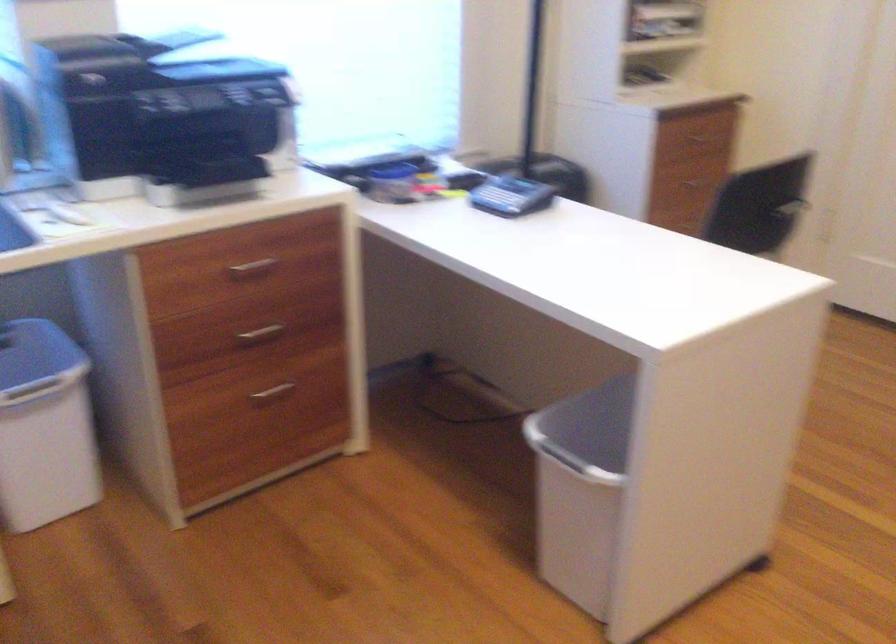
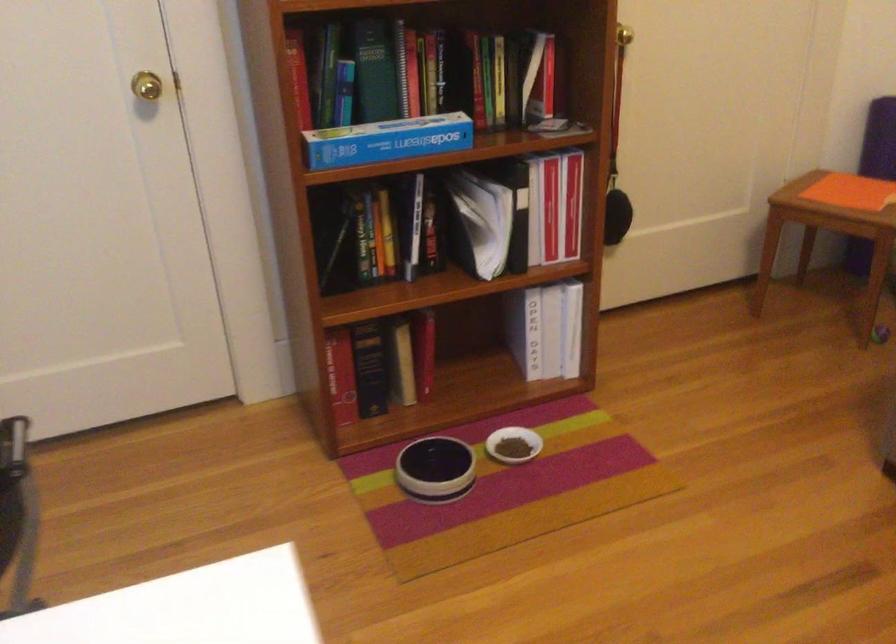
Consider the image. First-person continuous shooting, in which direction is the camera rotating?

The rotation direction of the camera is right-down.